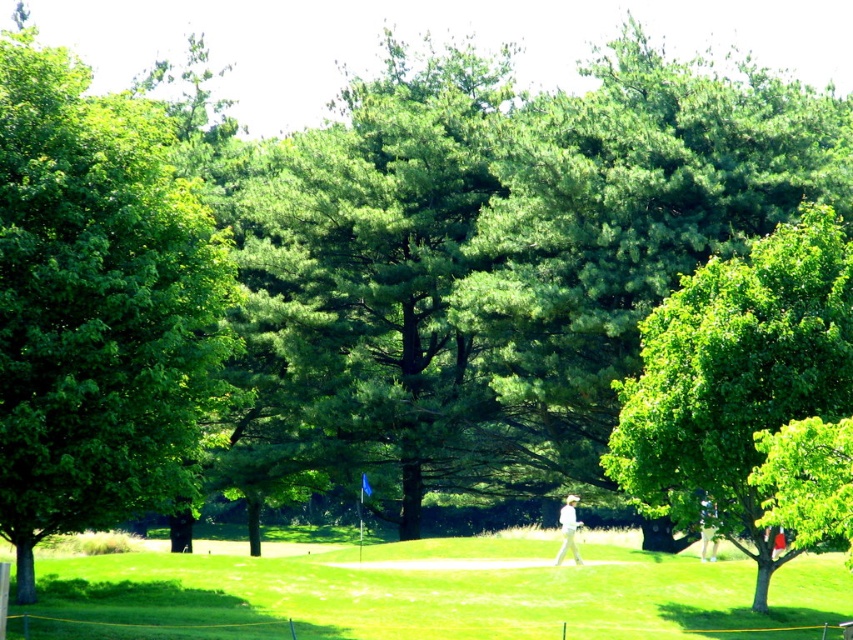
You are a drone operator trying to capture a photo of the golfer and the flagstick. The green grassy field at center and white fabric golfer at center are in your view. Which object is positioned to the left of the other?

The green grassy field at center is to the left of the white fabric golfer at center.

You are a golfer standing on the fairway and want to hit the ball towards the flagstick. There is a green leafy tree at left in your line of sight. Based on its coordinates, can you estimate if the tree will block your shot to the flagstick located at the left side of the image?

The green leafy tree at left is positioned at coordinates point (97,305), which may block your shot to the flagstick located at the left side of the image depending on the exact alignment. Check the tree position relative to your target.

You are a drone operator trying to capture a golf course scene. The green grassy field at center and the white fabric golfer at center are both in your view. Which object is taller?

The white fabric golfer at center is taller than the green grassy field at center.